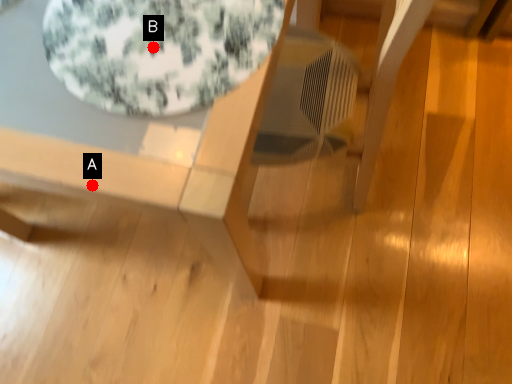
Question: Two points are circled on the image, labeled by A and B beside each circle. Which point is closer to the camera taking this photo?

Choices:
 (A) A is closer
 (B) B is closer

Answer: (A)